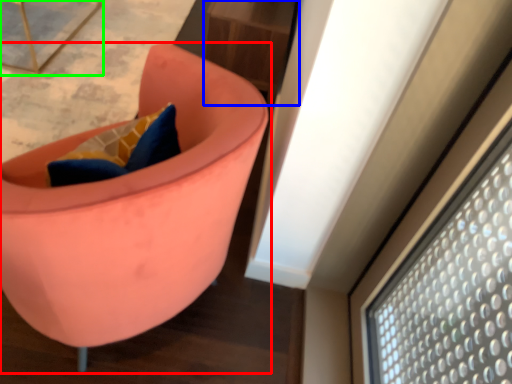
Question: Which object is the farthest from chair (highlighted by a red box)? Choose among these: table (highlighted by a blue box) or furniture (highlighted by a green box).

Choices:
 (A) table
 (B) furniture

Answer: (B)